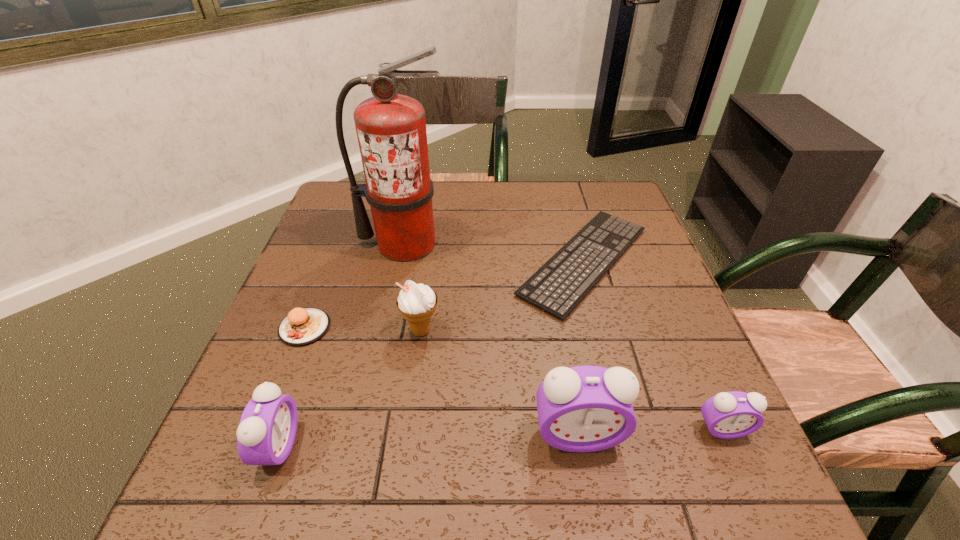
Locate an element on the screen. Image resolution: width=960 pixels, height=540 pixels. the second shortest alarm clock is located at coordinates (266, 433).

Locate an element on the screen. the fourth shortest object is located at coordinates (266, 433).

I want to click on the tallest alarm clock, so click(585, 408).

You are a GUI agent. You are given a task and a screenshot of the screen. Output one action in this format:
    pyautogui.click(x=<x>, y=<y>)
    Task: Click on the third shortest object
    Image resolution: width=960 pixels, height=540 pixels.
    Given the screenshot: What is the action you would take?
    (728, 415)

This screenshot has height=540, width=960. I want to click on the shortest alarm clock, so click(728, 415).

Locate an element on the screen. fire extinguisher is located at coordinates (391, 128).

Identify the location of the shortest object. (585, 266).

This screenshot has width=960, height=540. Identify the location of patty. (303, 326).

The width and height of the screenshot is (960, 540). In order to click on icecream in this screenshot , I will do `click(417, 303)`.

Image resolution: width=960 pixels, height=540 pixels. Find the location of `free space located 0.080m on the face of the second shortest alarm clock`. free space located 0.080m on the face of the second shortest alarm clock is located at coordinates (340, 446).